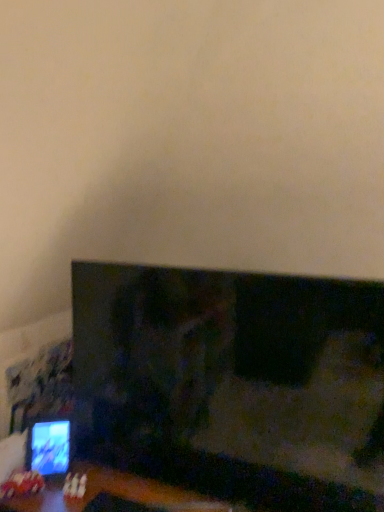
Question: Relative to matte black monitor at lower left, is matte black tv at lower left in front or behind?

Choices:
 (A) front
 (B) behind

Answer: (A)

Question: Would you say matte black tv at lower left is to the left or to the right of matte black monitor at lower left in the picture?

Choices:
 (A) left
 (B) right

Answer: (B)

Question: From the image's perspective, is matte black tv at lower left located above or below matte black monitor at lower left?

Choices:
 (A) below
 (B) above

Answer: (B)

Question: Considering the relative positions of matte black monitor at lower left and matte black tv at lower left in the image provided, is matte black monitor at lower left to the left or to the right of matte black tv at lower left?

Choices:
 (A) left
 (B) right

Answer: (A)

Question: From a real-world perspective, relative to matte black tv at lower left, is matte black monitor at lower left vertically above or below?

Choices:
 (A) above
 (B) below

Answer: (B)

Question: From the image's perspective, is matte black monitor at lower left above or below matte black tv at lower left?

Choices:
 (A) above
 (B) below

Answer: (B)

Question: Considering the positions of matte black monitor at lower left and matte black tv at lower left in the image, is matte black monitor at lower left wider or thinner than matte black tv at lower left?

Choices:
 (A) wide
 (B) thin

Answer: (B)